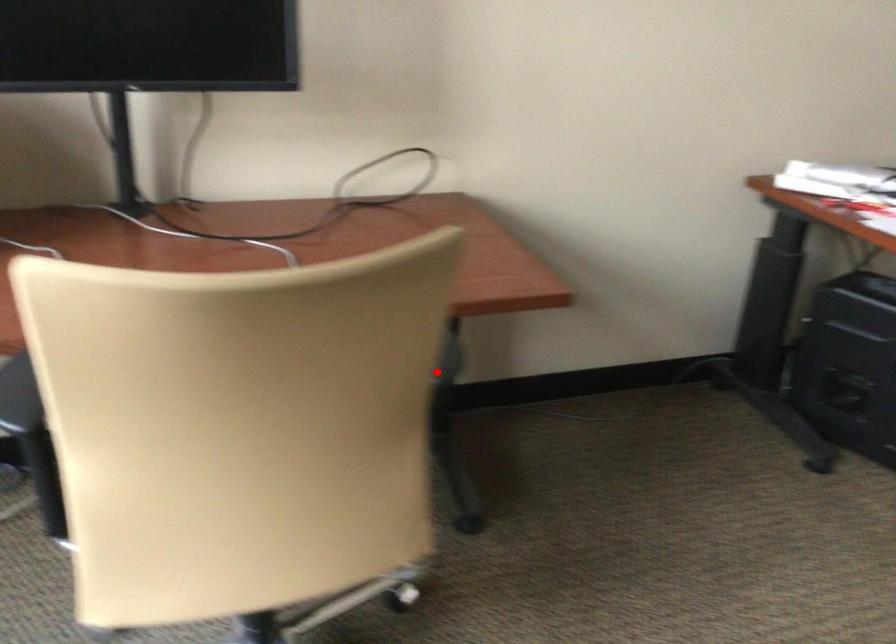
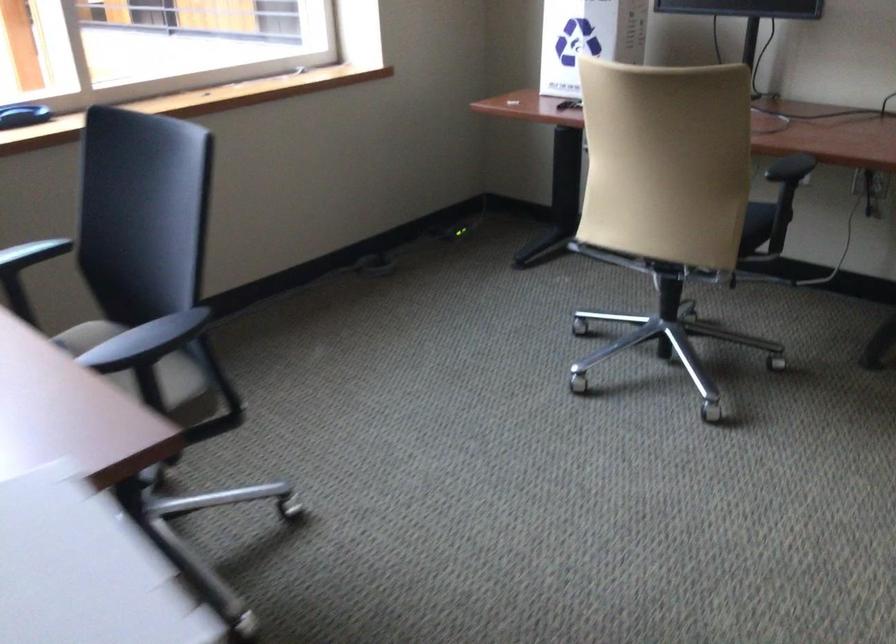
Question: I am providing you with two images of the same scene from different viewpoints. Given a red point in image1, look at the same physical point in image2. Is it:

Choices:
 (A) Closer to the viewpoint
 (B) Farther from the viewpoint

Answer: (B)